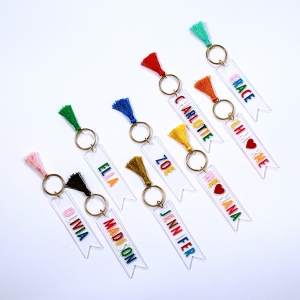
Locate an element on the screen. This screenshot has height=300, width=300. yellow tassel is located at coordinates (184, 134).